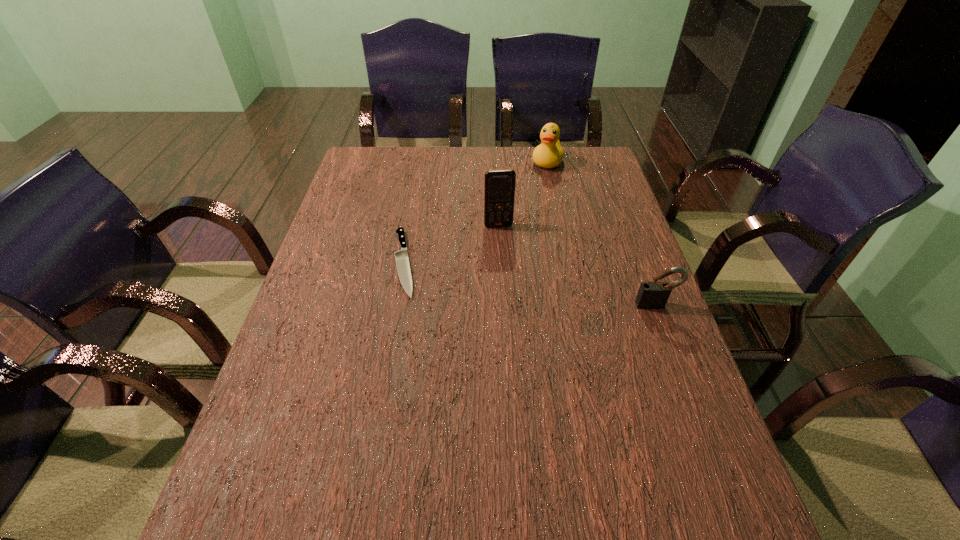
Where is `free space that is in between the duck and the steak knife`? free space that is in between the duck and the steak knife is located at coordinates (475, 212).

The width and height of the screenshot is (960, 540). What are the coordinates of `vacant area that lies between the third object from right to left and the third tallest object` in the screenshot? It's located at (577, 265).

Locate an element on the screen. The width and height of the screenshot is (960, 540). empty space between the rightmost object and the duck is located at coordinates (601, 233).

The image size is (960, 540). What are the coordinates of `vacant area that lies between the tallest object and the second shortest object` in the screenshot? It's located at (577, 265).

This screenshot has width=960, height=540. What are the coordinates of `free point between the leftmost object and the farthest object` in the screenshot? It's located at (475, 212).

Locate an element on the screen. vacant space that's between the tallest object and the leftmost object is located at coordinates (451, 244).

Identify the location of free space between the second farthest object and the nearest object. The height and width of the screenshot is (540, 960). (577, 265).

Image resolution: width=960 pixels, height=540 pixels. In order to click on the second closest object to the rightmost object in this screenshot , I will do `click(401, 257)`.

Where is `object that is the closest to the third nearest object`? object that is the closest to the third nearest object is located at coordinates (401, 257).